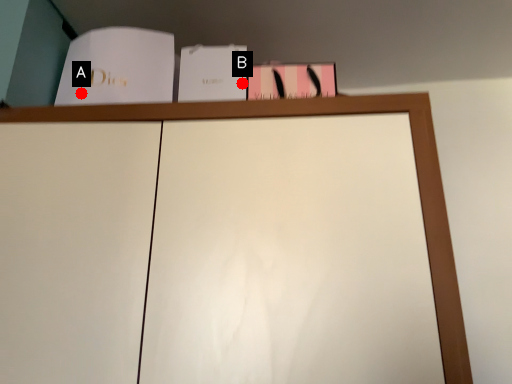
Question: Two points are circled on the image, labeled by A and B beside each circle. Which of the following is the farthest from the observer?

Choices:
 (A) A is further
 (B) B is further

Answer: (B)